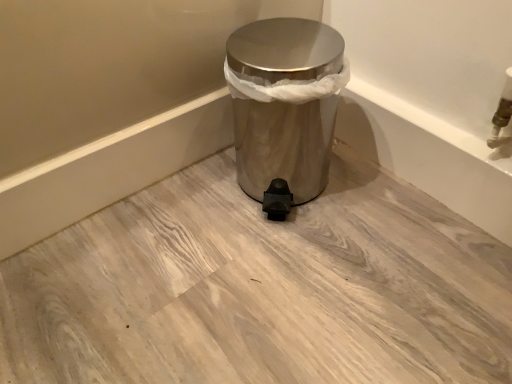
Image resolution: width=512 pixels, height=384 pixels. Identify the location of free space in front of polished stainless steel trash can at center. (310, 255).